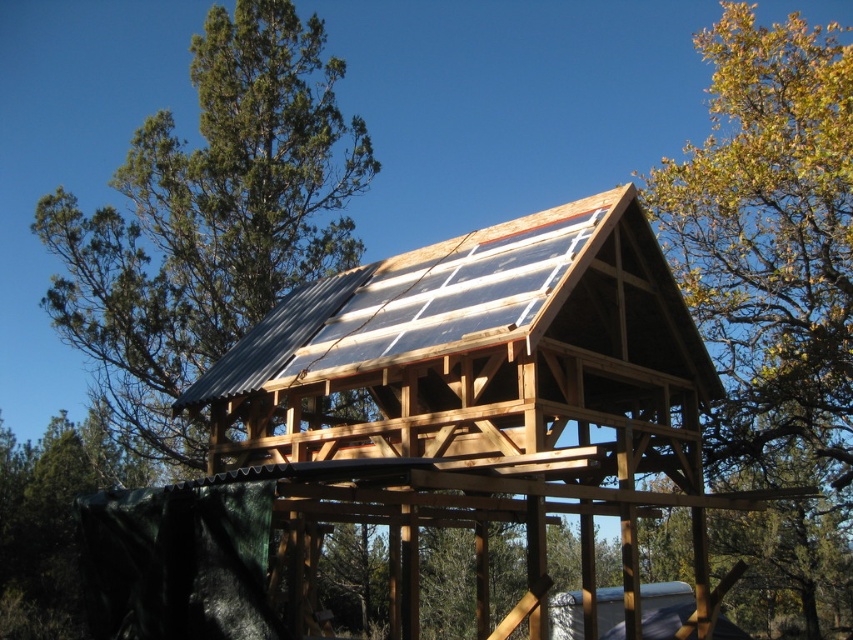
You are standing in front of the wooden structure with solar panels. There are two points marked on the roof, one at coordinates point (556, 451) and another at point (764, 520). If you want to reach the point closer to you, which one should you aim for?

You should aim for point (556, 451) because it is closer to the camera than point (764, 520).

You are planning to install a bird feeder between the green leafy tree at upper right and the green leafy tree at upper left. Which tree has a narrower width, and thus might require placing the feeder closer to it to avoid blocking sunlight?

The green leafy tree at upper right has a narrower width than the green leafy tree at upper left, so placing the bird feeder closer to it would be better to avoid blocking sunlight.

You are standing in front of the wooden structure and want to install a new solar panel. The existing metallic silver solar panel at center is currently positioned to the left of the green leafy tree at upper right. Which direction should you move the existing panel to align it directly under the tree?

To align the metallic silver solar panel at center directly under the green leafy tree at upper right, you should move it to the right since it is currently to the left of the tree.